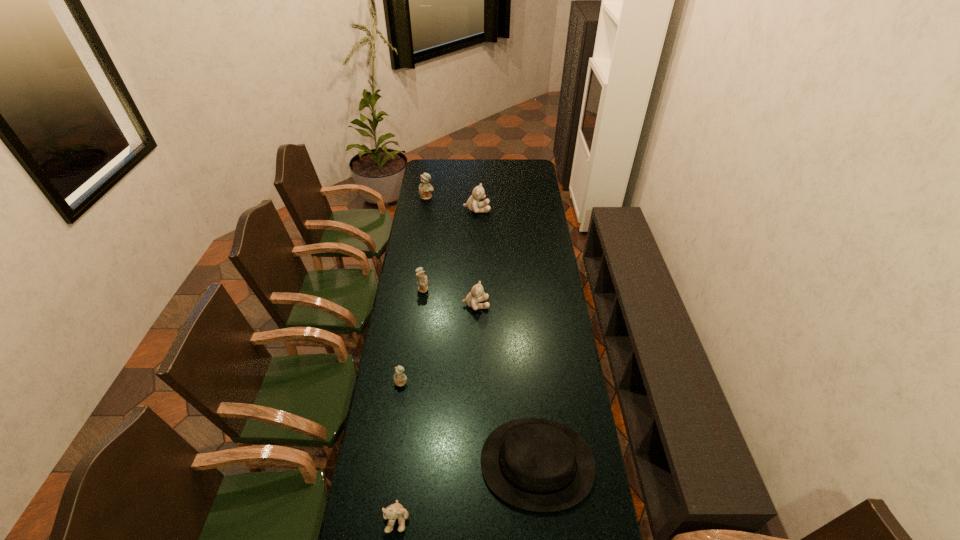
Locate an element on the screen. This screenshot has width=960, height=540. object that ranks as the fourth closest to the second nearest gray teddy bear is located at coordinates (473, 204).

Image resolution: width=960 pixels, height=540 pixels. Identify the location of object that is the fourth closest to the fourth farthest object. click(x=473, y=204).

Where is `teddy bear that is the nearest to the second farthest blue teddy bear`? This screenshot has width=960, height=540. teddy bear that is the nearest to the second farthest blue teddy bear is located at coordinates (477, 294).

Select which teddy bear is the closest to the second farthest teddy bear. Please provide its 2D coordinates. Your answer should be formatted as a tuple, i.e. [(x, y)], where the tuple contains the x and y coordinates of a point satisfying the conditions above.

[(425, 188)]

Where is `the second closest blue teddy bear to the second nearest teddy bear`? Image resolution: width=960 pixels, height=540 pixels. the second closest blue teddy bear to the second nearest teddy bear is located at coordinates (425, 188).

Choose which blue teddy bear is the second nearest neighbor to the nearest teddy bear. Please provide its 2D coordinates. Your answer should be formatted as a tuple, i.e. [(x, y)], where the tuple contains the x and y coordinates of a point satisfying the conditions above.

[(422, 280)]

Locate an element on the screen. This screenshot has width=960, height=540. the closest gray teddy bear relative to the fourth nearest object is located at coordinates (473, 204).

You are a GUI agent. You are given a task and a screenshot of the screen. Output one action in this format:
    pyautogui.click(x=<x>, y=<y>)
    Task: Click on the gray teddy bear that stands as the closest to the nearest gray teddy bear
    
    Given the screenshot: What is the action you would take?
    pyautogui.click(x=477, y=294)

This screenshot has height=540, width=960. Find the location of `vacant space that satisfies the following two spatial constraints: 1. on the front-facing side of the second nearest teddy bear; 2. on the left side of the fedora`. vacant space that satisfies the following two spatial constraints: 1. on the front-facing side of the second nearest teddy bear; 2. on the left side of the fedora is located at coordinates coord(390,463).

What are the coordinates of `blank space that satisfies the following two spatial constraints: 1. on the front-facing side of the second nearest teddy bear; 2. on the left side of the black fedora` in the screenshot? It's located at (390, 463).